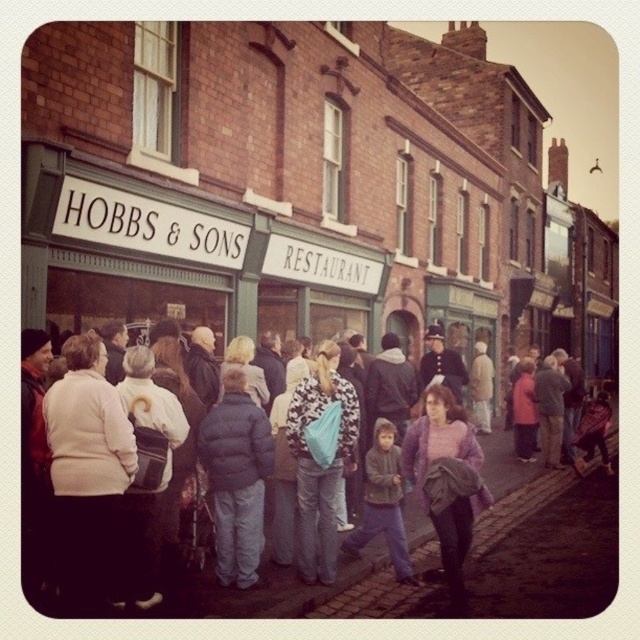
Question: Is dark blue puffer jacket at center bigger than denim jacket at center?

Choices:
 (A) no
 (B) yes

Answer: (B)

Question: Is matte blue jacket at center smaller than purple fuzzy sweater at center?

Choices:
 (A) yes
 (B) no

Answer: (B)

Question: Which point is closer to the camera?

Choices:
 (A) (234, 384)
 (B) (429, 413)
 (C) (266, 605)
 (D) (365, 483)

Answer: (C)

Question: Is purple fuzzy sweater at center smaller than denim jacket at center?

Choices:
 (A) no
 (B) yes

Answer: (A)

Question: Which of the following is the closest to the observer?

Choices:
 (A) dark blue puffer jacket at center
 (B) matte blue jacket at center
 (C) purple fuzzy sweater at center

Answer: (B)

Question: Which object appears farthest from the camera in this image?

Choices:
 (A) matte blue jacket at center
 (B) denim jacket at center
 (C) purple fuzzy sweater at center

Answer: (B)